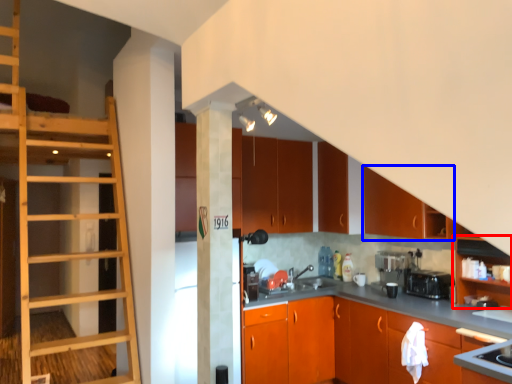
Question: Which point is closer to the camera, cabinetry (highlighted by a red box) or cabinetry (highlighted by a blue box)?

Choices:
 (A) cabinetry
 (B) cabinetry

Answer: (A)